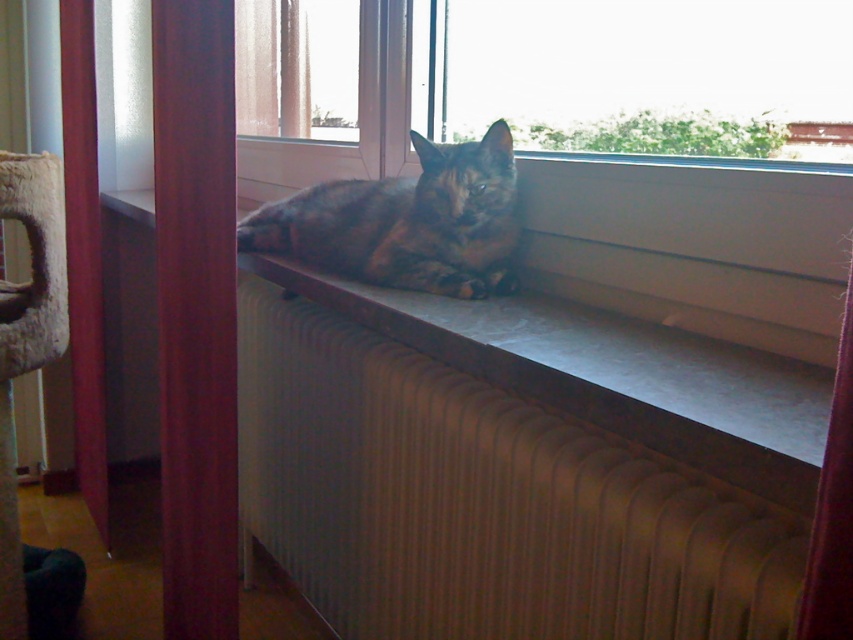
Question: Is transparent glass window at upper center positioned at the back of velvet red curtain at lower right?

Choices:
 (A) no
 (B) yes

Answer: (B)

Question: Considering the real-world distances, which object is closest to the velvet red curtain at lower right?

Choices:
 (A) metallic radiator at lower center
 (B) transparent glass window at upper center
 (C) tortoiseshell fur cat at window

Answer: (A)

Question: Estimate the real-world distances between objects in this image. Which object is farther from the metallic radiator at lower center?

Choices:
 (A) velvet red curtain at lower right
 (B) tortoiseshell fur cat at window
 (C) transparent glass window at upper center

Answer: (A)

Question: Is metallic radiator at lower center below velvet red curtain at lower right?

Choices:
 (A) yes
 (B) no

Answer: (A)

Question: Which point appears closest to the camera in this image?

Choices:
 (A) (776, 566)
 (B) (515, 42)
 (C) (842, 524)

Answer: (C)

Question: Can you confirm if metallic radiator at lower center is wider than tortoiseshell fur cat at window?

Choices:
 (A) no
 (B) yes

Answer: (B)